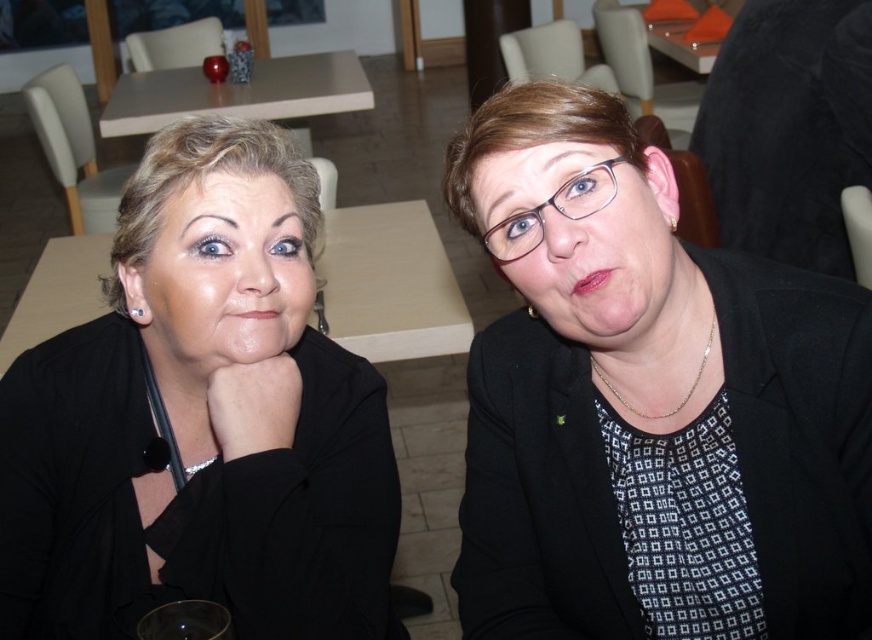
Does matte black glasses at center appear over matte wood table at upper center?

No, matte black glasses at center is not above matte wood table at upper center.

Measure the distance between matte black glasses at center and camera.

matte black glasses at center is 29.23 inches from camera.

Which is behind, point (581, 307) or point (140, 122)?

Positioned behind is point (140, 122).

Find the location of `matte black glasses at center`. matte black glasses at center is located at coordinates (605, 260).

Looking at this image, measure the distance between matte black blazer at center and camera.

matte black blazer at center is 28.99 inches from camera.

Is matte black blazer at center taller than matte wood table at upper center?

No.

The image size is (872, 640). In order to click on matte black blazer at center in this screenshot , I will do `click(649, 404)`.

Is matte black blazer at center to the right of matte black jacket at left from the viewer's perspective?

Correct, you'll find matte black blazer at center to the right of matte black jacket at left.

Can you confirm if matte black blazer at center is thinner than matte black jacket at left?

Yes, matte black blazer at center is thinner than matte black jacket at left.

Which is behind, point (748, 266) or point (210, 348)?

The point (210, 348) is more distant.

Locate an element on the screen. Image resolution: width=872 pixels, height=640 pixels. matte black blazer at center is located at coordinates (649, 404).